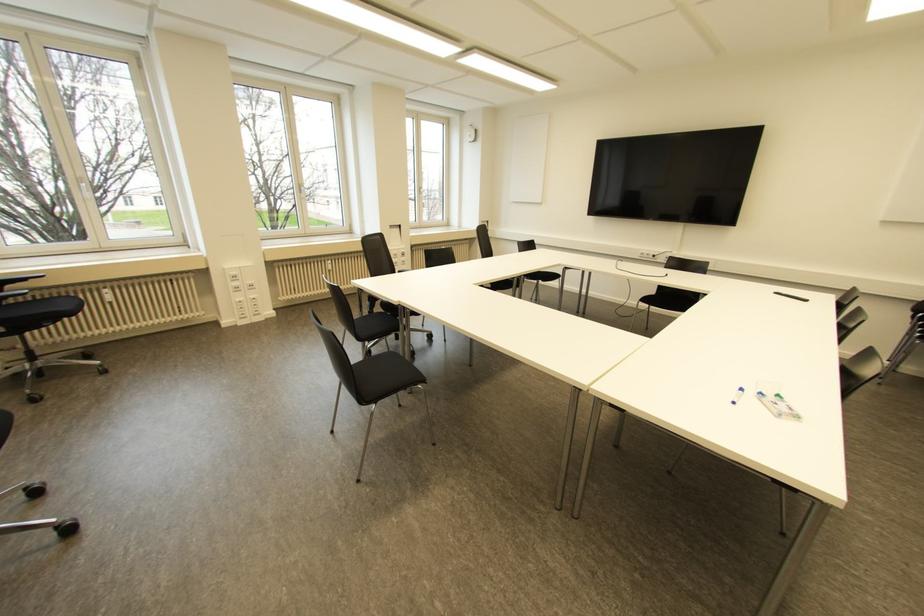
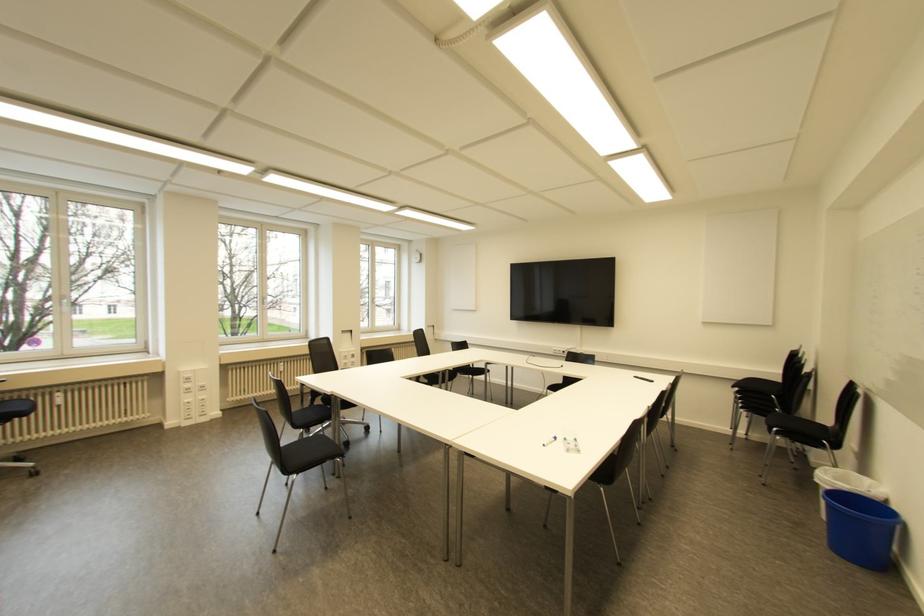
The point at (x=419, y=188) is marked in the first image. Where is the corresponding point in the second image?

(372, 299)